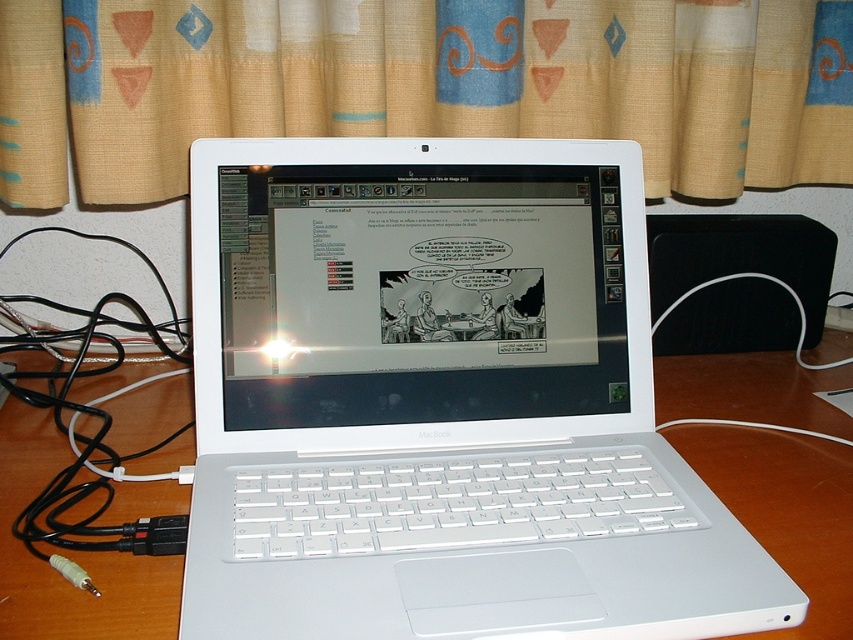
You are organizing a photo shoot and need to ensure that the beige fabric curtain at upper center and the white glossy laptop screen at center are both visible in the frame. Given their sizes, which object should you position closer to the camera to maintain clarity and detail in both?

Since the beige fabric curtain at upper center is larger than the white glossy laptop screen at center, you should position the white glossy laptop screen at center closer to the camera to ensure both objects are clearly visible in the frame.

You are organizing cables on a desk and notice the beige fabric curtain at upper center and the black cable at left. Which object is covering the other?

The beige fabric curtain at upper center is positioned over the black cable at left, so the curtain is covering the cable.

You are organizing cables on a desk and see the beige fabric curtain at upper center and the black cable at left. Which object is located to the right of the other?

The beige fabric curtain at upper center is positioned on the right side of black cable at left, so the beige fabric curtain at upper center is to the right of the black cable at left.